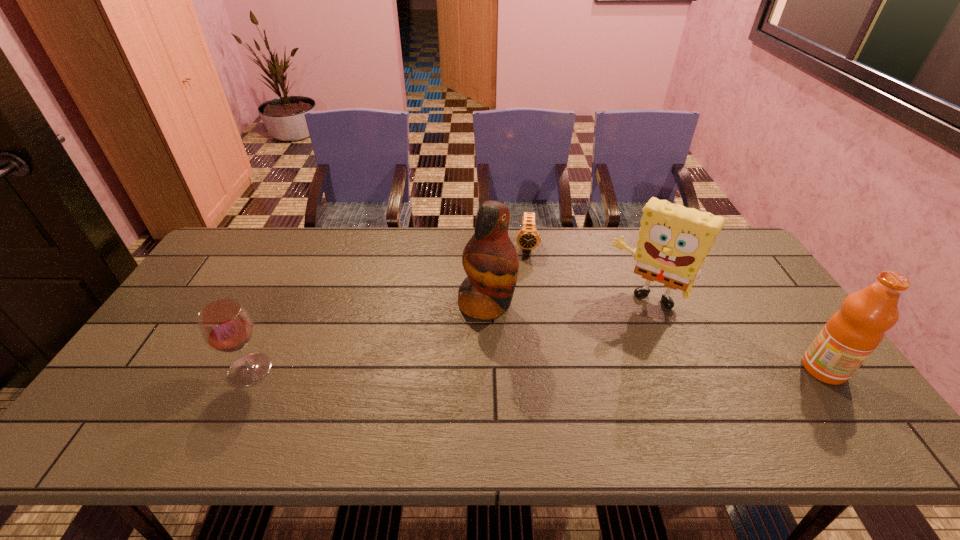
This screenshot has width=960, height=540. Identify the location of free space located 0.290m on the face of the tallest object. (604, 366).

Find the location of a particular element. The image size is (960, 540). vacant area situated on the face of the tallest object is located at coordinates pyautogui.click(x=525, y=323).

Where is `vacant space located on the face of the shortest object`? The width and height of the screenshot is (960, 540). vacant space located on the face of the shortest object is located at coordinates (525, 345).

You are a GUI agent. You are given a task and a screenshot of the screen. Output one action in this format:
    pyautogui.click(x=<x>, y=<y>)
    Task: Click on the vacant space located on the face of the shortest object
    
    Given the screenshot: What is the action you would take?
    pyautogui.click(x=526, y=305)

At what (x,y) coordinates should I click in order to perform the action: click on vacant space located on the face of the shortest object. Please return your answer as a coordinate pair (x, y). Looking at the image, I should click on (526, 330).

Image resolution: width=960 pixels, height=540 pixels. Find the location of `vacant area situated on the face of the fourth object from left to right`. vacant area situated on the face of the fourth object from left to right is located at coordinates (574, 411).

At what (x,y) coordinates should I click in order to perform the action: click on free region located 0.290m on the face of the fourth object from left to right. Please return your answer as a coordinate pair (x, y). This screenshot has height=540, width=960. Looking at the image, I should click on (589, 384).

The image size is (960, 540). I want to click on vacant space situated on the face of the fourth object from left to right, so click(x=585, y=393).

This screenshot has height=540, width=960. I want to click on object that is at the far edge, so click(528, 238).

Locate an element on the screen. wineglass located at the near edge is located at coordinates (225, 325).